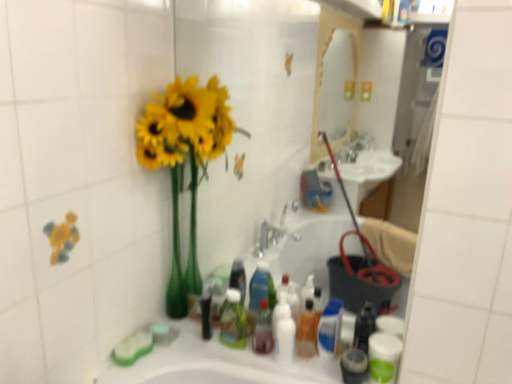
Question: In the image, is translucent plastic mouthwash at center, placed as the third mouthwash when sorted from right to left, positioned in front of or behind translucent plastic soap dispenser at center, the third toiletry in the left-to-right sequence?

Choices:
 (A) front
 (B) behind

Answer: (B)

Question: Would you say translucent plastic mouthwash at center, which is the second mouthwash in left-to-right order, is inside or outside translucent plastic soap dispenser at center, the first toiletry from the right?

Choices:
 (A) inside
 (B) outside

Answer: (B)

Question: Based on their relative distances, which object is nearer to the translucent plastic bottle at center, which is counted as the 3th toiletry, starting from the right?

Choices:
 (A) translucent plastic mouthwash at lower right, the 3th mouthwash viewed from the left
 (B) yellow matte vase at left
 (C) translucent plastic soap dispenser at center, the third toiletry in the left-to-right sequence
 (D) translucent plastic mouthwash at center, which ranks as the 1th mouthwash in left-to-right order
 (E) translucent plastic mouthwash at center, which is the second mouthwash in left-to-right order

Answer: (D)

Question: Which is nearer to the translucent plastic mouthwash at center, which is the second mouthwash in left-to-right order?

Choices:
 (A) white glossy bottle at center, arranged as the 2th toiletry when viewed from the right
 (B) translucent plastic mouthwash at lower right, the 3th mouthwash viewed from the left
 (C) white glossy mouthwash at lower right, marked as the first mouthwash in a right-to-left arrangement
 (D) yellow matte vase at left
 (E) translucent plastic soap dispenser at center, the third toiletry in the left-to-right sequence

Answer: (E)